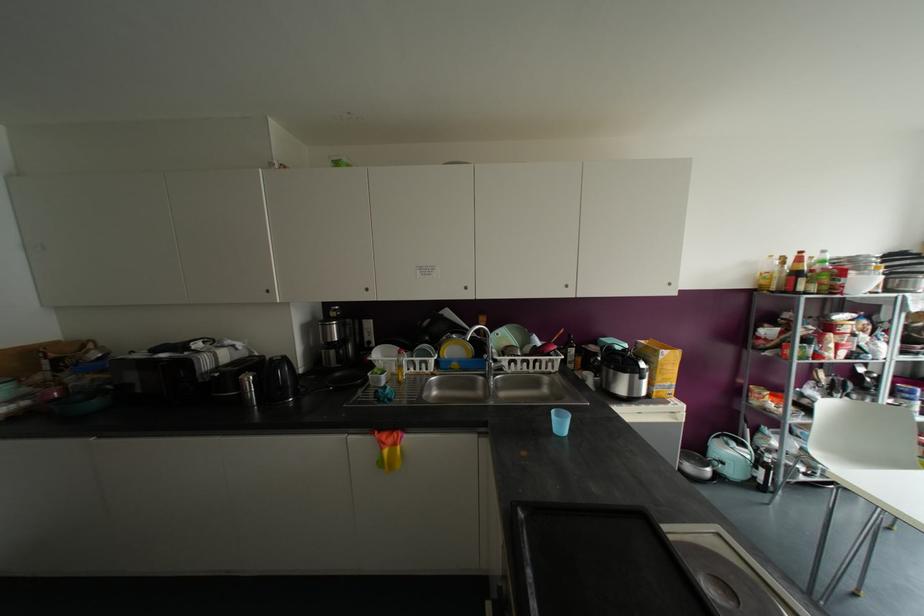
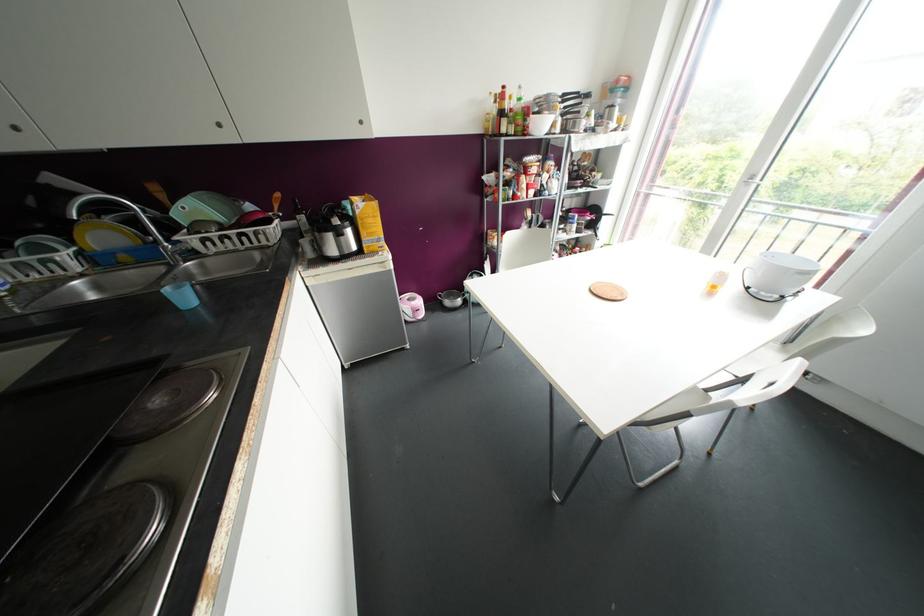
Find the pixel in the second image that matches the point at 565,286 in the first image.

(219, 124)